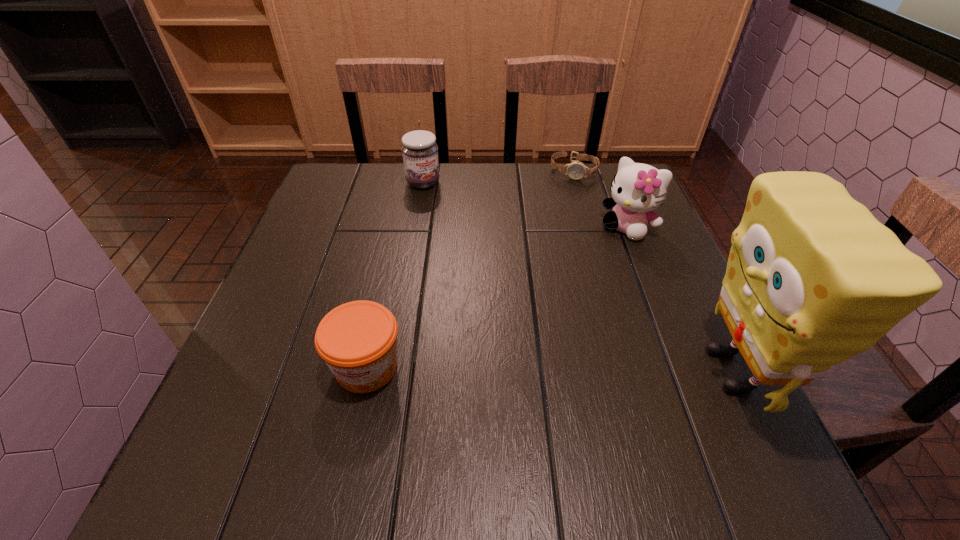
You are a GUI agent. You are given a task and a screenshot of the screen. Output one action in this format:
    pyautogui.click(x=<x>, y=<y>)
    Task: Click on the free region that satisfies the following two spatial constraints: 1. on the front label of the nearer jam; 2. on the face of the tallest object
    This screenshot has height=540, width=960.
    Given the screenshot: What is the action you would take?
    pyautogui.click(x=366, y=370)

Find the location of a particular element. The width and height of the screenshot is (960, 540). vacant space that satisfies the following two spatial constraints: 1. on the front side of the kitten; 2. on the right side of the watch is located at coordinates (590, 227).

You are a GUI agent. You are given a task and a screenshot of the screen. Output one action in this format:
    pyautogui.click(x=<x>, y=<y>)
    Task: Click on the free region that satisfies the following two spatial constraints: 1. on the front label of the tallest object; 2. on the face of the second shortest object
    Image resolution: width=960 pixels, height=540 pixels.
    Given the screenshot: What is the action you would take?
    (x=366, y=370)

Find the location of a particular element. This screenshot has width=960, height=540. vacant space that satisfies the following two spatial constraints: 1. on the front label of the second shortest object; 2. on the face of the tallest object is located at coordinates (366, 370).